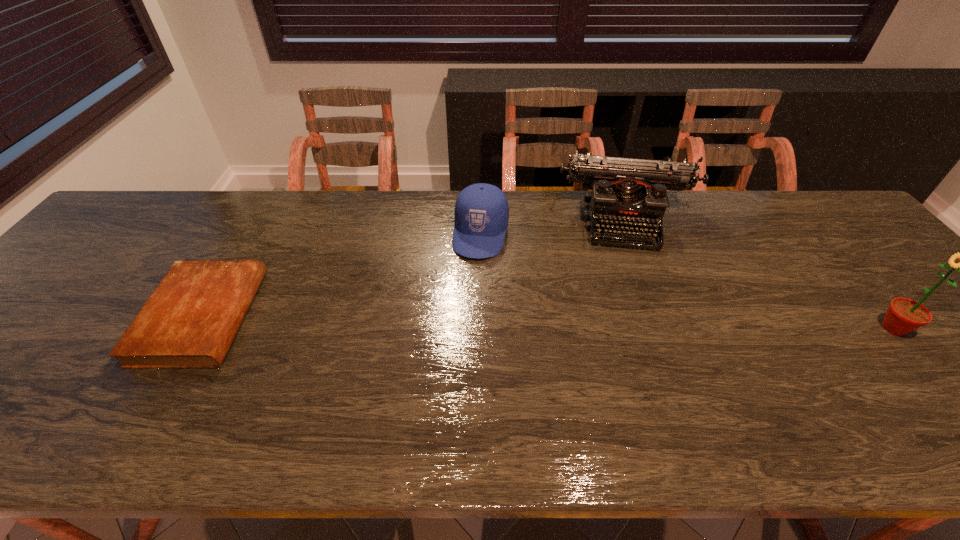
In order to click on object situated at the near edge in this screenshot , I will do `click(190, 320)`.

Identify the location of object located in the right edge section of the desktop. Image resolution: width=960 pixels, height=540 pixels. (904, 315).

In order to click on free space at the far edge of the desktop in this screenshot , I will do `click(345, 195)`.

Locate an element on the screen. free space at the near edge of the desktop is located at coordinates (514, 379).

Find the location of a particular element. vacant space at the left edge of the desktop is located at coordinates (100, 296).

Image resolution: width=960 pixels, height=540 pixels. What are the coordinates of `free space at the far left corner` in the screenshot? It's located at (148, 198).

You are a GUI agent. You are given a task and a screenshot of the screen. Output one action in this format:
    pyautogui.click(x=<x>, y=<y>)
    Task: Click on the free region at the far right corner of the desktop
    The width and height of the screenshot is (960, 540).
    Given the screenshot: What is the action you would take?
    pyautogui.click(x=825, y=199)

What are the coordinates of `free space between the third shortest object and the Bible` in the screenshot? It's located at (414, 267).

In order to click on free space between the third object from right to left and the second object from right to left in this screenshot , I will do `click(553, 226)`.

You are a GUI agent. You are given a task and a screenshot of the screen. Output one action in this format:
    pyautogui.click(x=<x>, y=<y>)
    Task: Click on the free space between the rightmost object and the cap
    The width and height of the screenshot is (960, 540).
    Given the screenshot: What is the action you would take?
    pyautogui.click(x=686, y=281)